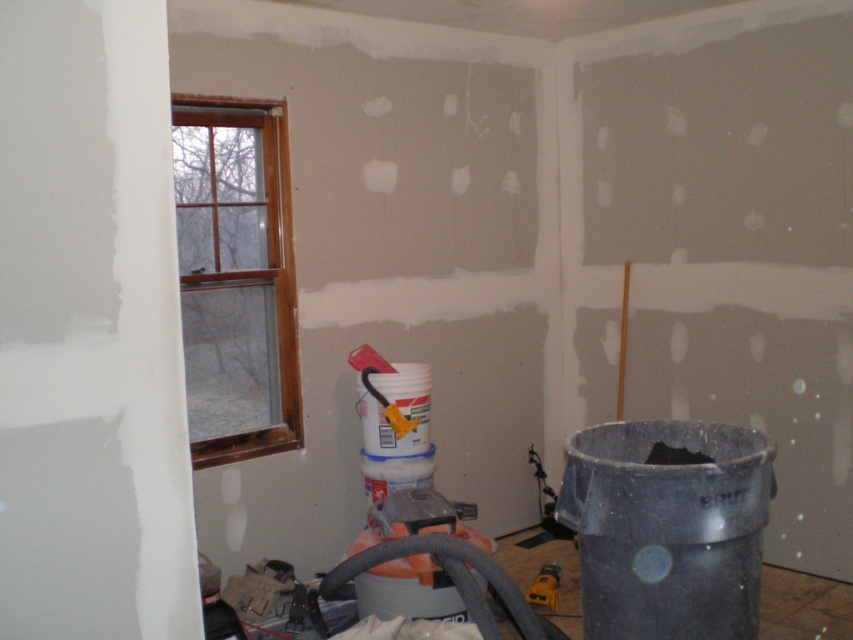
You are a contractor assessing the renovation site. You notice the brown wooden window at upper left and the yellow plastic tool at lower center. Which object has a greater width?

The brown wooden window at upper left has a greater width than the yellow plastic tool at lower center.